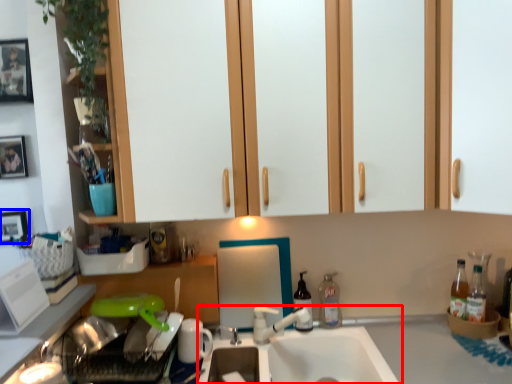
Question: Which of the following is the farthest to the observer, sink (highlighted by a red box) or picture frame (highlighted by a blue box)?

Choices:
 (A) sink
 (B) picture frame

Answer: (B)